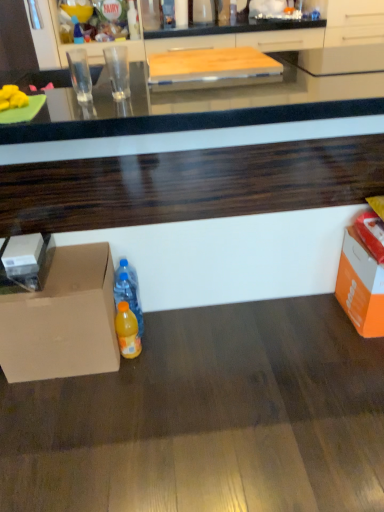
I want to click on translucent plastic bottle at upper left, positioned as the third bottle in right-to-left order, so click(x=77, y=31).

The height and width of the screenshot is (512, 384). In order to click on orange plastic bottle at lower center, which ranks as the first bottle in right-to-left order in this screenshot , I will do `click(127, 331)`.

This screenshot has width=384, height=512. Describe the element at coordinates (12, 97) in the screenshot. I see `yellow matte bananas at left` at that location.

Locate an element on the screen. The image size is (384, 512). matte cardboard box at lower left is located at coordinates (62, 319).

Where is `translucent plastic bottle at upper left, which appears as the third bottle when ordered from the bottom`? translucent plastic bottle at upper left, which appears as the third bottle when ordered from the bottom is located at coordinates (77, 31).

From the image's perspective, is orange cardboard box at lower right below orange plastic bottle at lower center, marked as the 3th bottle in a back-to-front arrangement?

No, from the image's perspective, orange cardboard box at lower right is not beneath orange plastic bottle at lower center, marked as the 3th bottle in a back-to-front arrangement.

Which is correct: orange cardboard box at lower right is inside orange plastic bottle at lower center, the 3th bottle positioned from the left, or outside of it?

orange cardboard box at lower right exists outside the volume of orange plastic bottle at lower center, the 3th bottle positioned from the left.

The height and width of the screenshot is (512, 384). What are the coordinates of `storage box that appears above the orange plastic bottle at lower center, which ranks as the first bottle in right-to-left order (from a real-world perspective)` in the screenshot? It's located at [360, 286].

Is orange cardboard box at lower right smaller than orange plastic bottle at lower center, marked as the 3th bottle in a back-to-front arrangement?

Incorrect, orange cardboard box at lower right is not smaller in size than orange plastic bottle at lower center, marked as the 3th bottle in a back-to-front arrangement.

Is yellow matte bananas at left further to the viewer compared to orange cardboard box at lower right?

No, the depth of yellow matte bananas at left is less than that of orange cardboard box at lower right.

Is yellow matte bananas at left not within orange cardboard box at lower right?

Indeed, yellow matte bananas at left is completely outside orange cardboard box at lower right.

Looking at their sizes, would you say yellow matte bananas at left is wider or thinner than orange cardboard box at lower right?

Clearly, yellow matte bananas at left has less width compared to orange cardboard box at lower right.

Is yellow matte bananas at left facing away from orange cardboard box at lower right?

No, yellow matte bananas at left's orientation is not away from orange cardboard box at lower right.

From a real-world perspective, is orange cardboard box at lower right above or below matte cardboard box at lower left?

From a real-world perspective, orange cardboard box at lower right is physically below matte cardboard box at lower left.

Identify the location of cardboard box on the left of orange cardboard box at lower right. (62, 319).

Between orange cardboard box at lower right and matte cardboard box at lower left, which one has more height?

Standing taller between the two is matte cardboard box at lower left.

From a real-world perspective, is translucent plastic bottle at upper left, placed as the 3th bottle when sorted from front to back, on top of orange plastic bottle at lower center, which ranks as the first bottle in right-to-left order?

Yes, from a real-world perspective, translucent plastic bottle at upper left, placed as the 3th bottle when sorted from front to back, is above orange plastic bottle at lower center, which ranks as the first bottle in right-to-left order.

Would you say translucent plastic bottle at upper left, marked as the 1th bottle in a left-to-right arrangement, is to the left or to the right of orange plastic bottle at lower center, marked as the 3th bottle in a back-to-front arrangement, in the picture?

Based on their positions, translucent plastic bottle at upper left, marked as the 1th bottle in a left-to-right arrangement, is located to the left of orange plastic bottle at lower center, marked as the 3th bottle in a back-to-front arrangement.

Would you say translucent plastic bottle at upper left, marked as the first bottle in a top-to-bottom arrangement, is a long distance from orange plastic bottle at lower center, the 3th bottle when ordered from top to bottom?

Indeed, translucent plastic bottle at upper left, marked as the first bottle in a top-to-bottom arrangement, is not near orange plastic bottle at lower center, the 3th bottle when ordered from top to bottom.

Is point (81, 34) more distant than point (126, 344)?

Yes, it is.

You are a GUI agent. You are given a task and a screenshot of the screen. Output one action in this format:
    pyautogui.click(x=<x>, y=<y>)
    Task: Click on the bottle above the white cardboard box at left (from the image's perspective)
    The image size is (384, 512).
    Given the screenshot: What is the action you would take?
    pyautogui.click(x=77, y=31)

Visually, is translucent plastic bottle at upper left, which is counted as the 1th bottle, starting from the back, positioned to the left or to the right of white cardboard box at left?

Based on their positions, translucent plastic bottle at upper left, which is counted as the 1th bottle, starting from the back, is located to the left of white cardboard box at left.

In terms of width, does translucent plastic bottle at upper left, which is counted as the 1th bottle, starting from the back, look wider or thinner when compared to white cardboard box at left?

translucent plastic bottle at upper left, which is counted as the 1th bottle, starting from the back, is thinner than white cardboard box at left.

Considering the positions of point (75, 30) and point (26, 257), is point (75, 30) closer or farther from the camera than point (26, 257)?

Point (75, 30).

Is orange cardboard box at lower right smaller than yellow matte bananas at left?

No.

Is point (359, 283) less distant than point (1, 97)?

That is False.

From the picture: Is orange cardboard box at lower right not inside yellow matte bananas at left?

Yes.

Looking at their sizes, would you say orange cardboard box at lower right is wider or thinner than yellow matte bananas at left?

orange cardboard box at lower right is wider than yellow matte bananas at left.

How many degrees apart are the facing directions of matte cardboard box at lower left and orange cardboard box at lower right?

0.00108 degrees separate the facing orientations of matte cardboard box at lower left and orange cardboard box at lower right.

In terms of height, does matte cardboard box at lower left look taller or shorter compared to orange cardboard box at lower right?

In the image, matte cardboard box at lower left appears to be taller than orange cardboard box at lower right.

From a real-world perspective, is matte cardboard box at lower left physically below orange cardboard box at lower right?

No, from a real-world perspective, matte cardboard box at lower left is not beneath orange cardboard box at lower right.

Which object is closer to the camera, matte cardboard box at lower left or orange cardboard box at lower right?

matte cardboard box at lower left.

From the orange cardboard box at lower right, count the 1st bottle to the left and point to it. Please provide its 2D coordinates.

[(127, 331)]

Where is `food in front of the orange cardboard box at lower right`? Image resolution: width=384 pixels, height=512 pixels. food in front of the orange cardboard box at lower right is located at coordinates (12, 97).

Based on their spatial positions, is yellow matte bananas at left or orange cardboard box at lower right further from translucent plastic bottle at center, which appears as the second bottle when viewed from the top?

The object further to translucent plastic bottle at center, which appears as the second bottle when viewed from the top, is orange cardboard box at lower right.

Considering their positions, is orange cardboard box at lower right positioned further to translucent plastic bottle at center, which ranks as the second bottle in right-to-left order, than orange plastic bottle at lower center, the 1th bottle from the bottom?

Among the two, orange cardboard box at lower right is located further to translucent plastic bottle at center, which ranks as the second bottle in right-to-left order.

Looking at this image, which object lies nearer to the anchor point white cardboard box at left, translucent plastic bottle at center, which is the second bottle in left-to-right order, or matte cardboard box at lower left?

Among the two, matte cardboard box at lower left is located nearer to white cardboard box at left.

Estimate the real-world distances between objects in this image. Which object is further from orange cardboard box at lower right, yellow matte bananas at left or matte cardboard box at lower left?

yellow matte bananas at left is further to orange cardboard box at lower right.

From the image, which object appears to be nearer to translucent plastic bottle at upper left, positioned as the third bottle in right-to-left order, translucent plastic bottle at center, the second bottle in the front-to-back sequence, or orange cardboard box at lower right?

translucent plastic bottle at center, the second bottle in the front-to-back sequence.

Which object lies further to the anchor point white cardboard box at left, orange cardboard box at lower right or orange plastic bottle at lower center, which ranks as the first bottle in right-to-left order?

The object further to white cardboard box at left is orange cardboard box at lower right.

When comparing their distances from white cardboard box at left, does matte cardboard box at lower left or yellow matte bananas at left seem closer?

Based on the image, matte cardboard box at lower left appears to be nearer to white cardboard box at left.

Based on their spatial positions, is yellow matte bananas at left or orange cardboard box at lower right closer to matte cardboard box at lower left?

yellow matte bananas at left is closer to matte cardboard box at lower left.

You are a GUI agent. You are given a task and a screenshot of the screen. Output one action in this format:
    pyautogui.click(x=<x>, y=<y>)
    Task: Click on the cardboard box between yellow matte bananas at left and orange plastic bottle at lower center, the 3th bottle positioned from the left, vertically
    The height and width of the screenshot is (512, 384).
    Given the screenshot: What is the action you would take?
    pyautogui.click(x=62, y=319)

The width and height of the screenshot is (384, 512). Find the location of `cardboard box situated between white cardboard box at left and orange cardboard box at lower right from left to right`. cardboard box situated between white cardboard box at left and orange cardboard box at lower right from left to right is located at coordinates (62, 319).

You are a GUI agent. You are given a task and a screenshot of the screen. Output one action in this format:
    pyautogui.click(x=<x>, y=<y>)
    Task: Click on the cardboard box between translucent plastic bottle at upper left, marked as the first bottle in a top-to-bottom arrangement, and orange plastic bottle at lower center, the first bottle viewed from the front, in the vertical direction
    The image size is (384, 512).
    Given the screenshot: What is the action you would take?
    pyautogui.click(x=62, y=319)

At what (x,y) coordinates should I click in order to perform the action: click on bottle between yellow matte bananas at left and orange plastic bottle at lower center, the 1th bottle from the bottom, from top to bottom. Please return your answer as a coordinate pair (x, y). The height and width of the screenshot is (512, 384). Looking at the image, I should click on (128, 291).